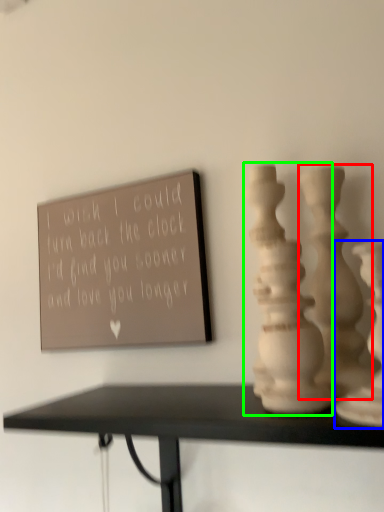
Question: Which is nearer to the vase (highlighted by a red box)? vase (highlighted by a blue box) or vase (highlighted by a green box).

Choices:
 (A) vase
 (B) vase

Answer: (B)